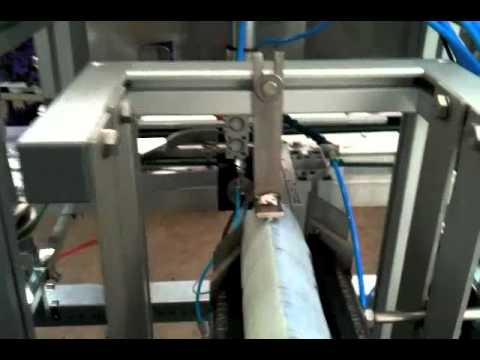
At what (x,y) coordinates should I click in order to perform the action: click on bracket. Please return your answer as a coordinate pair (x, y). The width and height of the screenshot is (480, 360). Looking at the image, I should click on (270, 138).